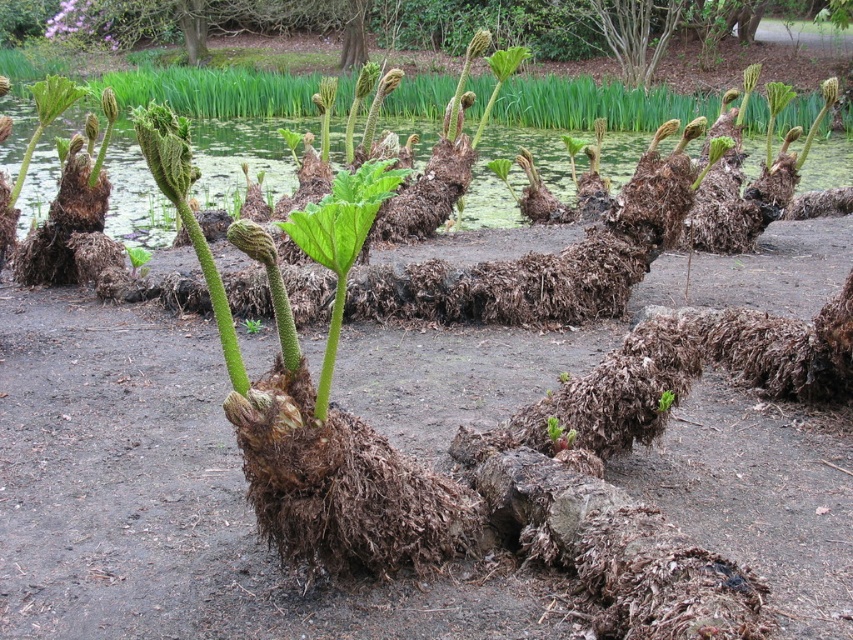
Question: Among these objects, which one is nearest to the camera?

Choices:
 (A) green mossy water at center
 (B) green fuzzy fern at center

Answer: (B)

Question: Which object is the closest to the green matte leafy plant at center?

Choices:
 (A) green fuzzy fern at center
 (B) green mossy water at center

Answer: (A)

Question: Does green mossy water at center appear under green fuzzy fern at center?

Choices:
 (A) no
 (B) yes

Answer: (A)

Question: Which point is closer to the camera?

Choices:
 (A) (831, 134)
 (B) (370, 164)

Answer: (B)

Question: Does green matte leafy plant at center appear on the left side of green fuzzy fern at center?

Choices:
 (A) no
 (B) yes

Answer: (B)

Question: Can you confirm if green mossy water at center is positioned below green matte leafy plant at center?

Choices:
 (A) no
 (B) yes

Answer: (A)